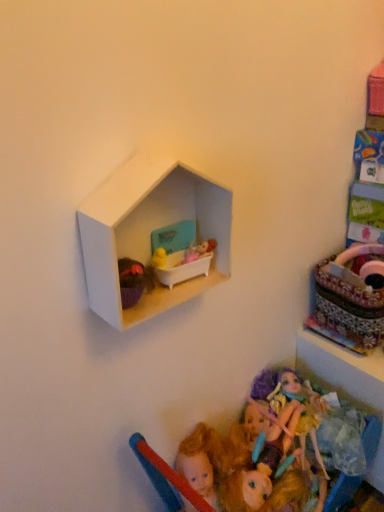
Question: Is matte plastic bathtub at upper center inside the boundaries of multicolored plush doll at lower center, or outside?

Choices:
 (A) inside
 (B) outside

Answer: (B)

Question: Is point (195, 272) closer or farther from the camera than point (198, 456)?

Choices:
 (A) closer
 (B) farther

Answer: (A)

Question: Which is farther from the matte plastic bathtub at upper center?

Choices:
 (A) patterned fabric basket at right
 (B) multicolored plush doll at lower center
 (C) white matte hexagonal shelf at upper center

Answer: (A)

Question: Considering the real-world distances, which object is closest to the patterned fabric basket at right?

Choices:
 (A) matte plastic bathtub at upper center
 (B) multicolored plush doll at lower center
 (C) white matte hexagonal shelf at upper center

Answer: (B)